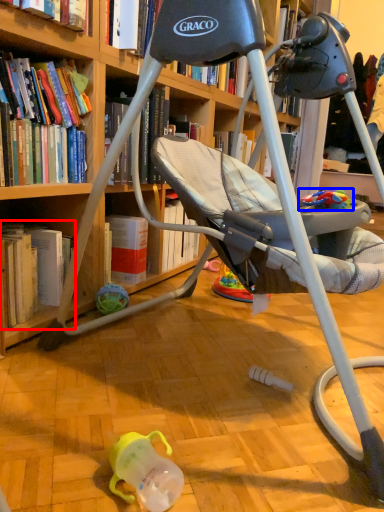
Question: Which of the following is the farthest to the observer, book (highlighted by a red box) or toy (highlighted by a blue box)?

Choices:
 (A) book
 (B) toy

Answer: (A)